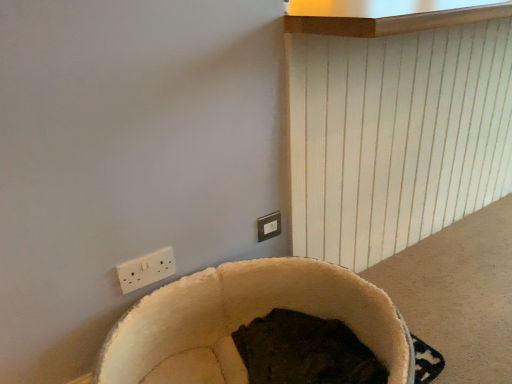
Question: From a real-world perspective, is matte white switch at upper center physically above beige plush bean bag chair at lower center?

Choices:
 (A) no
 (B) yes

Answer: (B)

Question: Is matte white switch at upper center at the right side of beige plush bean bag chair at lower center?

Choices:
 (A) yes
 (B) no

Answer: (B)

Question: Considering the relative sizes of matte white switch at upper center and beige plush bean bag chair at lower center in the image provided, is matte white switch at upper center thinner than beige plush bean bag chair at lower center?

Choices:
 (A) no
 (B) yes

Answer: (B)

Question: Could you tell me if matte white switch at upper center is facing beige plush bean bag chair at lower center?

Choices:
 (A) no
 (B) yes

Answer: (A)

Question: From the image's perspective, would you say matte white switch at upper center is positioned over beige plush bean bag chair at lower center?

Choices:
 (A) no
 (B) yes

Answer: (B)

Question: Considering the relative sizes of matte white switch at upper center and beige plush bean bag chair at lower center in the image provided, is matte white switch at upper center bigger than beige plush bean bag chair at lower center?

Choices:
 (A) yes
 (B) no

Answer: (B)

Question: Is white plastic power plugs and sockets at lower left facing towards matte white switch at upper center?

Choices:
 (A) yes
 (B) no

Answer: (B)

Question: Is white plastic power plugs and sockets at lower left positioned in front of matte white switch at upper center?

Choices:
 (A) yes
 (B) no

Answer: (A)

Question: From a real-world perspective, is white plastic power plugs and sockets at lower left on matte white switch at upper center?

Choices:
 (A) no
 (B) yes

Answer: (B)

Question: Is the position of white plastic power plugs and sockets at lower left more distant than that of matte white switch at upper center?

Choices:
 (A) yes
 (B) no

Answer: (B)

Question: Is matte white switch at upper center completely or partially inside white plastic power plugs and sockets at lower left?

Choices:
 (A) yes
 (B) no

Answer: (B)

Question: Can you confirm if white plastic power plugs and sockets at lower left is bigger than matte white switch at upper center?

Choices:
 (A) yes
 (B) no

Answer: (A)

Question: Is the position of beige plush bean bag chair at lower center more distant than that of white plastic power plugs and sockets at lower left?

Choices:
 (A) yes
 (B) no

Answer: (B)